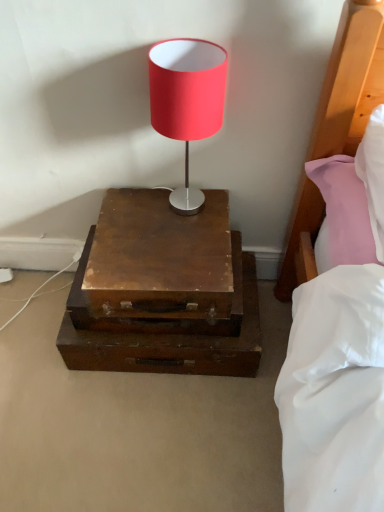
Locate an element on the screen. The image size is (384, 512). vacant region to the left of matte red lampshade at center is located at coordinates (122, 215).